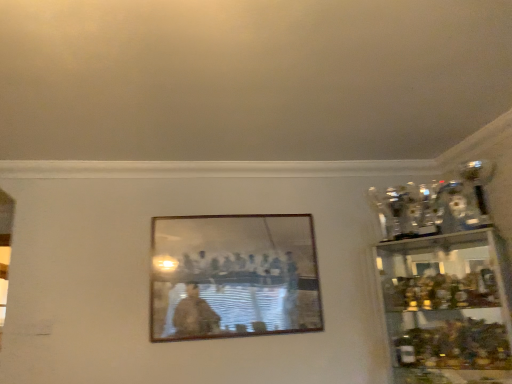
This screenshot has width=512, height=384. Describe the element at coordinates (233, 276) in the screenshot. I see `wooden picture frame at center` at that location.

The width and height of the screenshot is (512, 384). I want to click on wooden picture frame at center, so click(233, 276).

Locate an element on the screen. This screenshot has height=384, width=512. clear glass cabinet at right is located at coordinates (448, 308).

Measure the distance between clear glass cabinet at right and camera.

The depth of clear glass cabinet at right is 6.66 feet.

Image resolution: width=512 pixels, height=384 pixels. Describe the element at coordinates (448, 308) in the screenshot. I see `clear glass cabinet at right` at that location.

Where is `wooden picture frame at center`? This screenshot has height=384, width=512. wooden picture frame at center is located at coordinates (233, 276).

Which is more to the right, clear glass cabinet at right or wooden picture frame at center?

Positioned to the right is clear glass cabinet at right.

In the image, is clear glass cabinet at right positioned in front of or behind wooden picture frame at center?

In the image, clear glass cabinet at right appears in front of wooden picture frame at center.

Does point (412, 311) come in front of point (298, 236)?

That is True.

From the image's perspective, would you say clear glass cabinet at right is positioned over wooden picture frame at center?

Incorrect, from the image's perspective, clear glass cabinet at right is lower than wooden picture frame at center.

From a real-world perspective, is clear glass cabinet at right beneath wooden picture frame at center?

Yes, from a real-world perspective, clear glass cabinet at right is under wooden picture frame at center.

Can you confirm if clear glass cabinet at right is wider than wooden picture frame at center?

Yes.

Is clear glass cabinet at right taller or shorter than wooden picture frame at center?

In the image, clear glass cabinet at right appears to be taller than wooden picture frame at center.

Who is smaller, clear glass cabinet at right or wooden picture frame at center?

With smaller size is wooden picture frame at center.

From the picture: Would you say clear glass cabinet at right is outside wooden picture frame at center?

Yes, clear glass cabinet at right is not within wooden picture frame at center.

In the scene shown: Can you see clear glass cabinet at right touching wooden picture frame at center?

No, clear glass cabinet at right is not touching wooden picture frame at center.

Could you tell me if clear glass cabinet at right is turned towards wooden picture frame at center?

No.

How much distance is there between clear glass cabinet at right and wooden picture frame at center?

clear glass cabinet at right and wooden picture frame at center are 32.65 inches apart from each other.

Locate an element on the screen. shelf located in front of the wooden picture frame at center is located at coordinates (448, 308).

Is wooden picture frame at center to the left or to the right of clear glass cabinet at right in the image?

Clearly, wooden picture frame at center is on the left of clear glass cabinet at right in the image.

Is wooden picture frame at center in front of or behind clear glass cabinet at right in the image?

Visually, wooden picture frame at center is located behind clear glass cabinet at right.

Which is behind, point (243, 238) or point (488, 375)?

The point (243, 238) is farther.

From the image's perspective, between wooden picture frame at center and clear glass cabinet at right, which one is located above?

wooden picture frame at center.

From a real-world perspective, who is located higher, wooden picture frame at center or clear glass cabinet at right?

In real-world perspective, wooden picture frame at center is above.

Based on the photo, does wooden picture frame at center have a greater width compared to clear glass cabinet at right?

No, wooden picture frame at center is not wider than clear glass cabinet at right.

Is wooden picture frame at center shorter than clear glass cabinet at right?

Indeed, wooden picture frame at center has a lesser height compared to clear glass cabinet at right.

Based on their sizes in the image, would you say wooden picture frame at center is bigger or smaller than clear glass cabinet at right?

wooden picture frame at center is smaller than clear glass cabinet at right.

Is wooden picture frame at center spatially inside clear glass cabinet at right, or outside of it?

wooden picture frame at center exists outside the volume of clear glass cabinet at right.

Is wooden picture frame at center far from clear glass cabinet at right?

They are positioned close to each other.

In the scene shown: Is wooden picture frame at center positioned with its back to clear glass cabinet at right?

wooden picture frame at center is not turned away from clear glass cabinet at right.

How much distance is there between wooden picture frame at center and clear glass cabinet at right?

A distance of 32.65 inches exists between wooden picture frame at center and clear glass cabinet at right.

Locate an element on the screen. shelf directly beneath the wooden picture frame at center (from a real-world perspective) is located at coordinates (448, 308).

Find the location of a particular element. picture frame above the clear glass cabinet at right (from the image's perspective) is located at coordinates (233, 276).

This screenshot has width=512, height=384. Identify the location of shelf that is in front of the wooden picture frame at center. click(x=448, y=308).